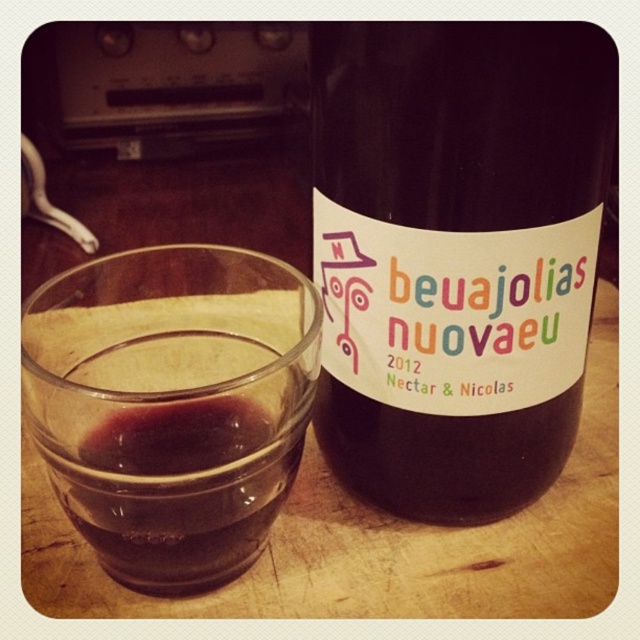
Looking at this image, you are a wine taster standing at the edge of the table where the dark glass bottle at center is located. You need to pour the remaining wine into a glass. Where exactly should you place your hand to grip the bottle? Please provide the coordinates in the format of point coordinates.

The dark glass bottle at center is located at point coordinates of (456, 253). You should place your hand around this position to grip the bottle.

In the scene shown: You are holding a small flashlight and want to shine it directly on the dark glass bottle at center to read its label. Considering the distance between you and the bottle, can you estimate if you need to adjust your flashlight angle to focus the light properly?

The dark glass bottle at center is 6.28 inches away from the viewer. Since this distance is relatively short, you can position the flashlight close to the bottle without needing a wide angle to focus the light properly.